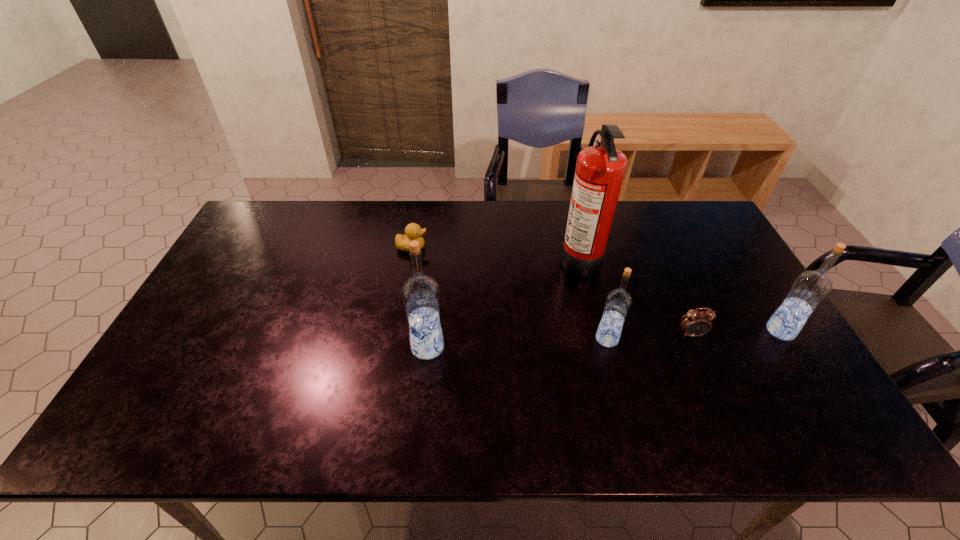
In order to click on blank space that satisfies the following two spatial constraints: 1. on the back side of the third shortest object; 2. facing forward on the duckling in this screenshot , I will do `click(584, 247)`.

Where is `free point that satisfies the following two spatial constraints: 1. facing forward on the duckling; 2. on the back side of the rightmost vodka`? The width and height of the screenshot is (960, 540). free point that satisfies the following two spatial constraints: 1. facing forward on the duckling; 2. on the back side of the rightmost vodka is located at coordinates (397, 330).

At what (x,y) coordinates should I click in order to perform the action: click on free region that satisfies the following two spatial constraints: 1. on the back side of the rightmost object; 2. on the right side of the leftmost vodka. Please return your answer as a coordinate pair (x, y). The image size is (960, 540). Looking at the image, I should click on (429, 330).